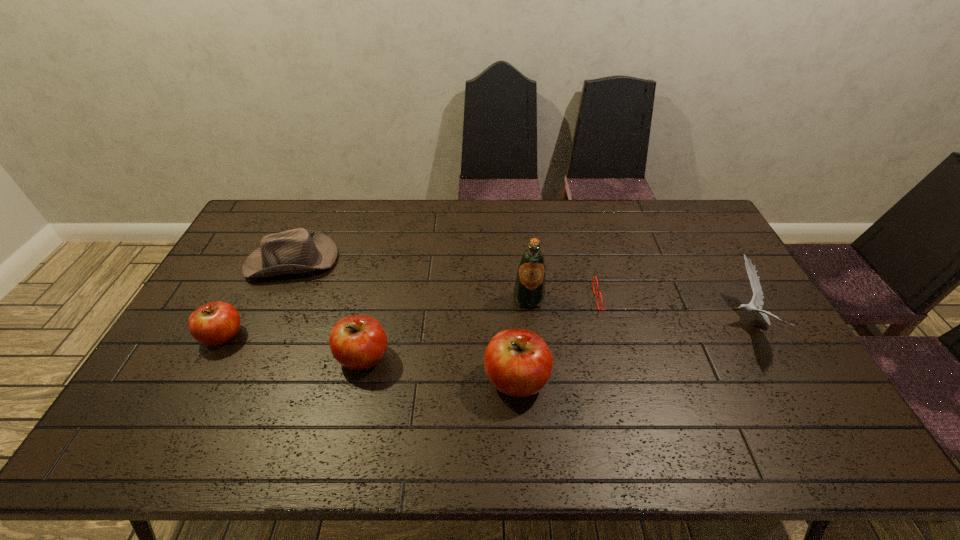
Find the location of `the leftmost apple`. the leftmost apple is located at coordinates (214, 323).

Where is `the second tallest apple`? This screenshot has width=960, height=540. the second tallest apple is located at coordinates click(x=358, y=342).

The width and height of the screenshot is (960, 540). I want to click on the second apple from left to right, so click(358, 342).

I want to click on the rightmost apple, so click(x=518, y=362).

The image size is (960, 540). Identify the location of the sixth object from left to right. (593, 277).

Find the location of `spectacles`. spectacles is located at coordinates (593, 277).

Find the location of a particular element. This screenshot has height=540, width=960. fedora is located at coordinates (298, 250).

I want to click on the rightmost object, so (x=757, y=300).

Where is `olive oil`? olive oil is located at coordinates (529, 291).

Identify the location of vacant point located 0.050m on the right of the leftmost apple. (262, 336).